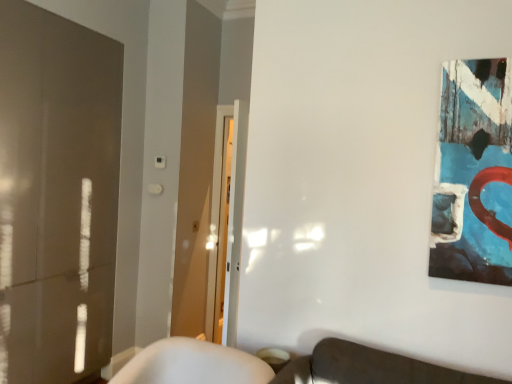
Question: Does textured canvas artwork at upper right appear on the left side of matte glass door at left?

Choices:
 (A) yes
 (B) no

Answer: (B)

Question: From the image's perspective, is textured canvas artwork at upper right located beneath matte glass door at left?

Choices:
 (A) no
 (B) yes

Answer: (A)

Question: From a real-world perspective, is textured canvas artwork at upper right positioned over matte glass door at left based on gravity?

Choices:
 (A) no
 (B) yes

Answer: (B)

Question: Considering the relative sizes of textured canvas artwork at upper right and matte glass door at left in the image provided, is textured canvas artwork at upper right taller than matte glass door at left?

Choices:
 (A) yes
 (B) no

Answer: (B)

Question: Does textured canvas artwork at upper right have a lesser height compared to matte glass door at left?

Choices:
 (A) yes
 (B) no

Answer: (A)

Question: Is textured canvas artwork at upper right thinner than matte glass door at left?

Choices:
 (A) yes
 (B) no

Answer: (A)

Question: Is matte glass door at left bigger than textured canvas artwork at upper right?

Choices:
 (A) no
 (B) yes

Answer: (B)

Question: Would you say textured canvas artwork at upper right is part of matte glass door at left's contents?

Choices:
 (A) yes
 (B) no

Answer: (B)

Question: Considering the relative sizes of matte glass door at left and textured canvas artwork at upper right in the image provided, is matte glass door at left wider than textured canvas artwork at upper right?

Choices:
 (A) yes
 (B) no

Answer: (A)

Question: From the image's perspective, would you say matte glass door at left is positioned over textured canvas artwork at upper right?

Choices:
 (A) no
 (B) yes

Answer: (A)

Question: Does matte glass door at left lie in front of textured canvas artwork at upper right?

Choices:
 (A) no
 (B) yes

Answer: (A)

Question: Is matte glass door at left outside textured canvas artwork at upper right?

Choices:
 (A) yes
 (B) no

Answer: (A)

Question: From a real-world perspective, is matte glass door at left physically located above or below textured canvas artwork at upper right?

Choices:
 (A) above
 (B) below

Answer: (B)